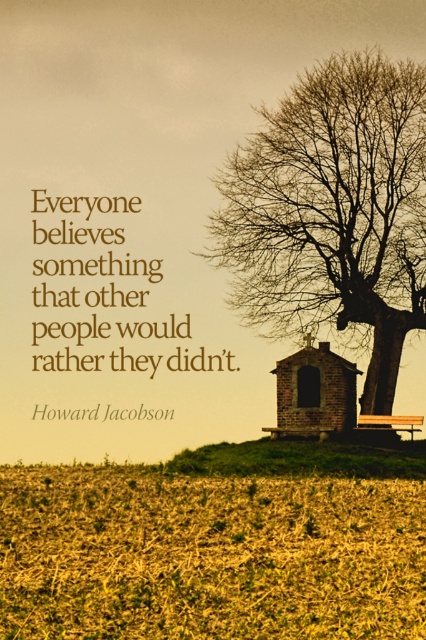
Is green grassy hill at lower center smaller than wooden park bench at lower right?

Incorrect, green grassy hill at lower center is not smaller in size than wooden park bench at lower right.

What are the coordinates of `green grassy hill at lower center` in the screenshot? It's located at (307, 456).

Locate an element on the screen. green grassy hill at lower center is located at coordinates (307, 456).

Between green grassy hill at lower center and brick chapel at center, which one is positioned higher?

brick chapel at center

Can you confirm if green grassy hill at lower center is thinner than brick chapel at center?

No, green grassy hill at lower center is not thinner than brick chapel at center.

At what (x,y) coordinates should I click in order to perform the action: click on green grassy hill at lower center. Please return your answer as a coordinate pair (x, y). Image resolution: width=426 pixels, height=640 pixels. Looking at the image, I should click on (307, 456).

Find the location of a particular element. The image size is (426, 640). green grassy hill at lower center is located at coordinates (307, 456).

Is bare wood tree at upper right in front of brick chapel at center?

No, it is not.

Is bare wood tree at upper right above brick chapel at center?

Yes, bare wood tree at upper right is above brick chapel at center.

Locate an element on the screen. bare wood tree at upper right is located at coordinates (333, 211).

Where is `bare wood tree at upper right`? bare wood tree at upper right is located at coordinates (333, 211).